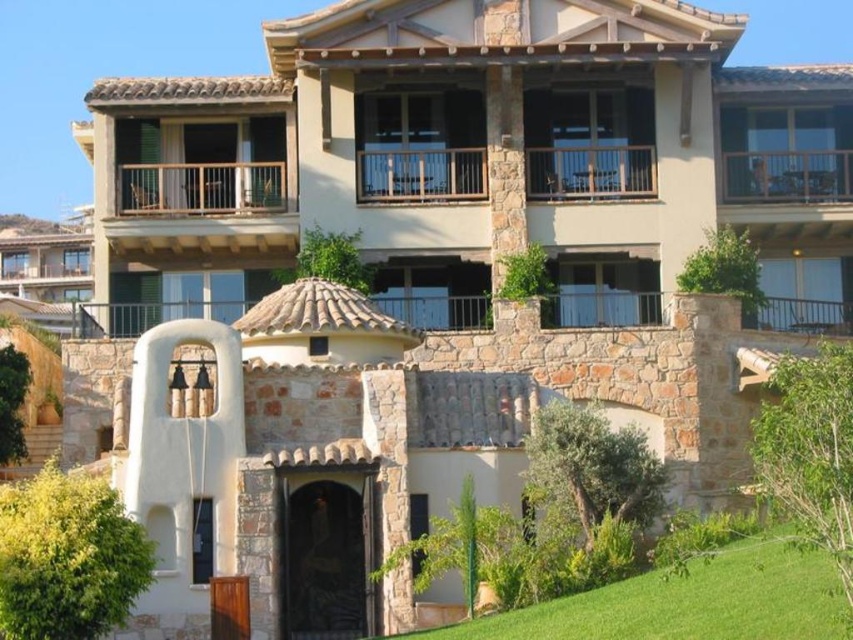
Between point (790, 612) and point (737, 154), which one is positioned behind?

Positioned behind is point (737, 154).

Where is `green grass at lower right`? This screenshot has width=853, height=640. green grass at lower right is located at coordinates (682, 593).

Is green grass at lower right positioned in front of wooden at upper center?

Yes, green grass at lower right is closer to the viewer.

Who is lower down, green grass at lower right or wooden at upper center?

green grass at lower right is below.

Between point (509, 576) and point (181, 179), which one is positioned behind?

The point (181, 179) is behind.

Find the location of a particular element. The image size is (853, 640). green grass at lower right is located at coordinates (682, 593).

Does brown wooden railing at upper center appear on the right side of wooden at upper center?

Indeed, brown wooden railing at upper center is positioned on the right side of wooden at upper center.

Can you confirm if brown wooden railing at upper center is positioned to the left of wooden at upper center?

Incorrect, brown wooden railing at upper center is not on the left side of wooden at upper center.

Is point (485, 156) positioned after point (120, 204)?

No, (485, 156) is closer to viewer.

Identify the location of brown wooden railing at upper center. (589, 172).